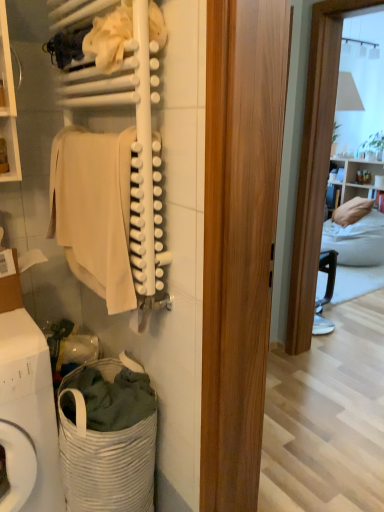
This screenshot has height=512, width=384. What do you see at coordinates (94, 40) in the screenshot?
I see `white fabric at upper center` at bounding box center [94, 40].

Where is `white woven laundry basket at lower left`? This screenshot has height=512, width=384. white woven laundry basket at lower left is located at coordinates (28, 417).

Find the location of `white fabric at upper center`. white fabric at upper center is located at coordinates (94, 40).

Which of these two, beige cotton towel at left or white fabric at upper center, stands shorter?

With less height is white fabric at upper center.

Measure the distance between beige cotton towel at left and white fabric at upper center.

15.25 inches.

Considering the relative sizes of beige cotton towel at left and white fabric at upper center in the image provided, is beige cotton towel at left smaller than white fabric at upper center?

Actually, beige cotton towel at left might be larger than white fabric at upper center.

Is beige cotton towel at left oriented away from white fabric at upper center?

No.

From the image's perspective, who appears lower, beige cotton towel at left or white woven laundry basket at lower left?

white woven laundry basket at lower left is shown below in the image.

Is beige cotton towel at left turned away from white woven laundry basket at lower left?

No, white woven laundry basket at lower left is not at the back of beige cotton towel at left.

Locate an element on the screen. This screenshot has height=512, width=384. clothing above the white woven laundry basket at lower left (from a real-world perspective) is located at coordinates click(94, 210).

Between beige cotton towel at left and white woven laundry basket at lower left, which one appears on the left side from the viewer's perspective?

From the viewer's perspective, beige cotton towel at left appears more on the left side.

Is white woven laundry basket at lower left at the back of white fabric at upper center?

No, white fabric at upper center's orientation is not away from white woven laundry basket at lower left.

Consider the image. From the image's perspective, is white fabric at upper center positioned above or below white woven laundry basket at lower left?

white fabric at upper center is situated higher than white woven laundry basket at lower left in the image.

Between white fabric at upper center and white woven laundry basket at lower left, which one has smaller size?

white fabric at upper center is smaller.

Is white fabric at upper center surrounding white woven laundry basket at lower left?

No, white woven laundry basket at lower left is not surrounded by white fabric at upper center.

From the image's perspective, is white woven laundry basket at lower left on top of white matte towel at upper left?

No.

Does point (153, 460) come closer to viewer compared to point (158, 273)?

No, (153, 460) is behind (158, 273).

Is white matte towel at upper left closer to the viewer compared to white woven laundry basket at lower left?

That is True.

Which is more to the right, white matte towel at upper left or white woven laundry basket at lower left?

Positioned to the right is white matte towel at upper left.

From the image's perspective, is white matte towel at upper left positioned above or below white woven laundry basket at lower left?

From the image's perspective, white matte towel at upper left appears above white woven laundry basket at lower left.

You are a GUI agent. You are given a task and a screenshot of the screen. Output one action in this format:
    pyautogui.click(x=<x>, y=<y>)
    Task: Click on the washing machine that is behind the white matte towel at upper left
    
    Given the screenshot: What is the action you would take?
    pyautogui.click(x=28, y=417)

From a real-world perspective, is white woven laundry basket at lower left beneath white matte towel at upper left?

Yes, from a real-world perspective, white woven laundry basket at lower left is beneath white matte towel at upper left.

Is white matte towel at upper left at the back of white woven laundry basket at lower left?

No.

Is white woven laundry basket at lower left with white matte towel at upper left?

No, white woven laundry basket at lower left is not next to white matte towel at upper left.

In terms of size, does white matte towel at upper left appear bigger or smaller than white woven laundry basket at lower left?

Clearly, white matte towel at upper left is smaller in size than white woven laundry basket at lower left.

Which object is wider, white matte towel at upper left or white woven laundry basket at lower left?

Wider between the two is white woven laundry basket at lower left.

Is the surface of white matte towel at upper left in direct contact with white woven laundry basket at lower left?

They are not placed beside each other.

Would you say white matte towel at upper left contains white woven laundry basket at lower left?

No.

Identify the location of laundry above the beige cotton towel at left (from a real-world perspective). Image resolution: width=384 pixels, height=512 pixels. (94, 40).

Find the location of a particular element. This screenshot has width=384, height=512. clothing that is on the left side of white woven laundry basket at lower left is located at coordinates point(94,210).

Based on their spatial positions, is white matte towel at upper left or white fabric at upper center further from beige cotton towel at left?

white fabric at upper center is further to beige cotton towel at left.

Considering their positions, is white woven laundry basket at lower left positioned closer to white matte towel at upper left than white woven laundry basket at lower left?

white woven laundry basket at lower left.

Estimate the real-world distances between objects in this image. Which object is closer to white woven laundry basket at lower left, white woven laundry basket at lower left or white matte towel at upper left?

white woven laundry basket at lower left lies closer to white woven laundry basket at lower left than the other object.

Estimate the real-world distances between objects in this image. Which object is closer to white fabric at upper center, white woven laundry basket at lower left or white matte towel at upper left?

white matte towel at upper left is positioned closer to the anchor white fabric at upper center.

Looking at the image, which one is located further to white woven laundry basket at lower left, white matte towel at upper left or white fabric at upper center?

white fabric at upper center is further to white woven laundry basket at lower left.

Considering their positions, is white fabric at upper center positioned further to white matte towel at upper left than beige cotton towel at left?

white fabric at upper center.

In the scene shown: Which object lies nearer to the anchor point beige cotton towel at left, white matte towel at upper left or white woven laundry basket at lower left?

white matte towel at upper left.

From the image, which object appears to be nearer to white woven laundry basket at lower left, white fabric at upper center or white matte towel at upper left?

white matte towel at upper left is closer to white woven laundry basket at lower left.

Where is `washing machine between white matte towel at upper left and white woven laundry basket at lower left from top to bottom`? washing machine between white matte towel at upper left and white woven laundry basket at lower left from top to bottom is located at coordinates (28, 417).

Where is `washing machine that lies between beige cotton towel at left and white woven laundry basket at lower left from top to bottom`? This screenshot has height=512, width=384. washing machine that lies between beige cotton towel at left and white woven laundry basket at lower left from top to bottom is located at coordinates (28, 417).

Image resolution: width=384 pixels, height=512 pixels. What are the coordinates of `closet between white fabric at upper center and beige cotton towel at left from top to bottom` in the screenshot? It's located at (113, 169).

I want to click on closet between white fabric at upper center and white woven laundry basket at lower left vertically, so click(x=113, y=169).